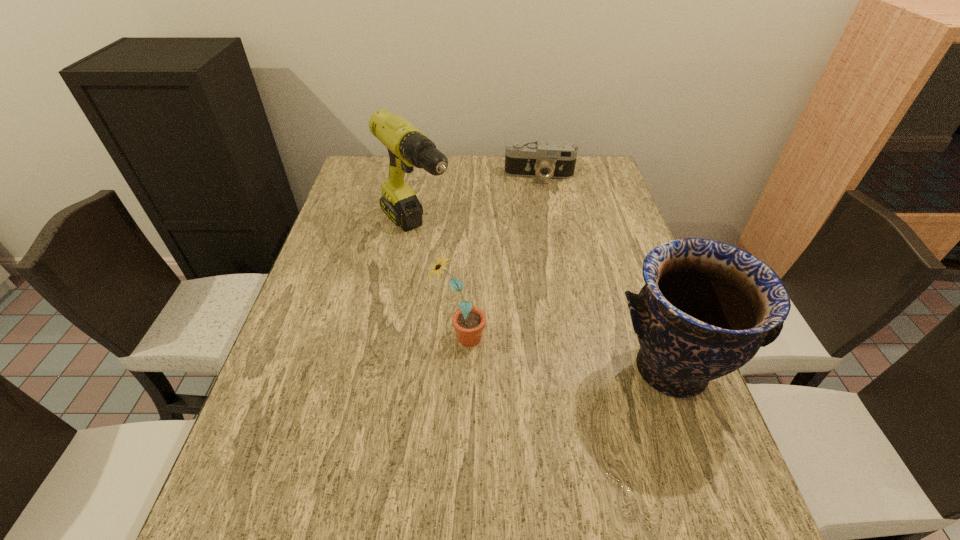
I want to click on free space on the desktop that is between the sunflower and the pottery and is positioned on the handle side of the second farthest object, so click(x=536, y=349).

Locate an element on the screen. This screenshot has height=540, width=960. free space on the desktop that is between the sunflower and the pottery and is positioned on the lens of the shortest object is located at coordinates (540, 350).